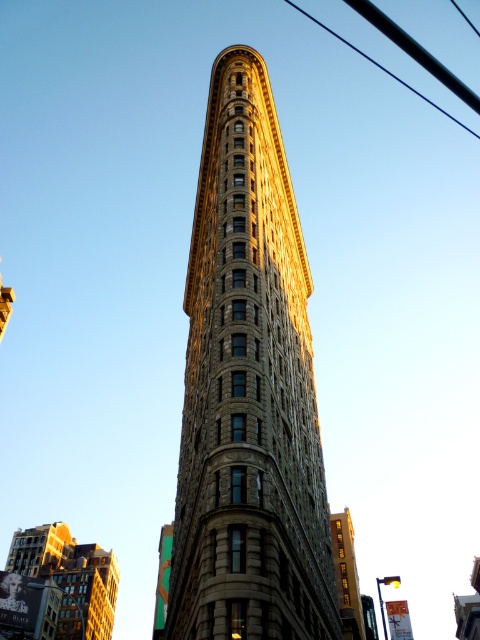
Is brown stone building at center thinner than black wire at upper right?

Correct, brown stone building at center's width is less than black wire at upper right's.

Is point (257, 291) farther from camera compared to point (452, 115)?

No.

Which is in front, point (320, 589) or point (466, 125)?

Positioned in front is point (320, 589).

This screenshot has height=640, width=480. What are the coordinates of `brown stone building at center` in the screenshot? It's located at (249, 392).

In the scene shown: Does brown stone building at lower right have a lesser height compared to black wire at upper right?

Correct, brown stone building at lower right is not as tall as black wire at upper right.

Is brown stone building at lower right thinner than black wire at upper right?

Indeed, brown stone building at lower right has a lesser width compared to black wire at upper right.

The image size is (480, 640). I want to click on brown stone building at lower right, so click(347, 576).

Locate an element on the screen. brown stone building at lower right is located at coordinates (347, 576).

Who is shorter, brown stone building at center or brown stone building at lower left?

brown stone building at lower left is shorter.

Does brown stone building at center have a lesser width compared to brown stone building at lower left?

Yes, brown stone building at center is thinner than brown stone building at lower left.

Describe the element at coordinates (249, 392) in the screenshot. I see `brown stone building at center` at that location.

Locate an element on the screen. The width and height of the screenshot is (480, 640). brown stone building at center is located at coordinates (249, 392).